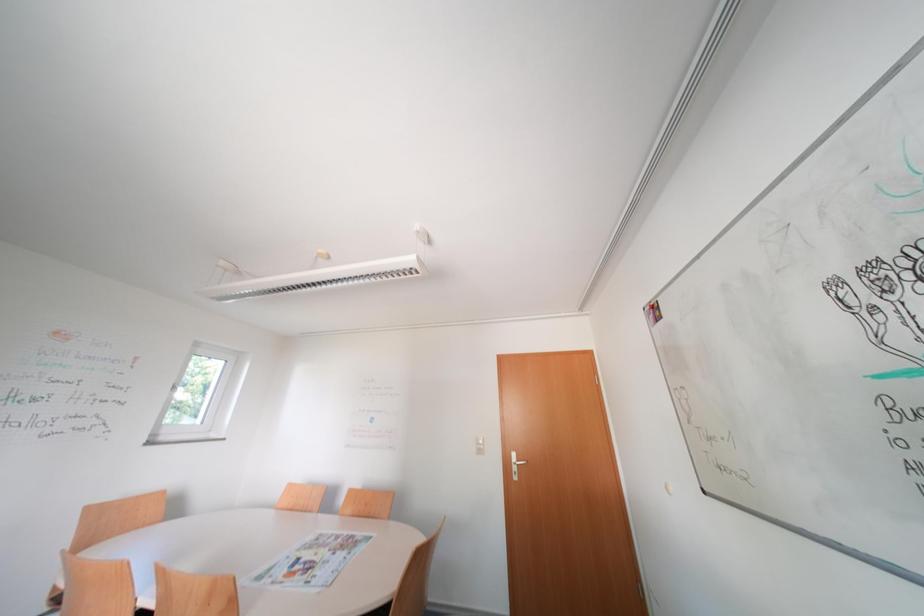
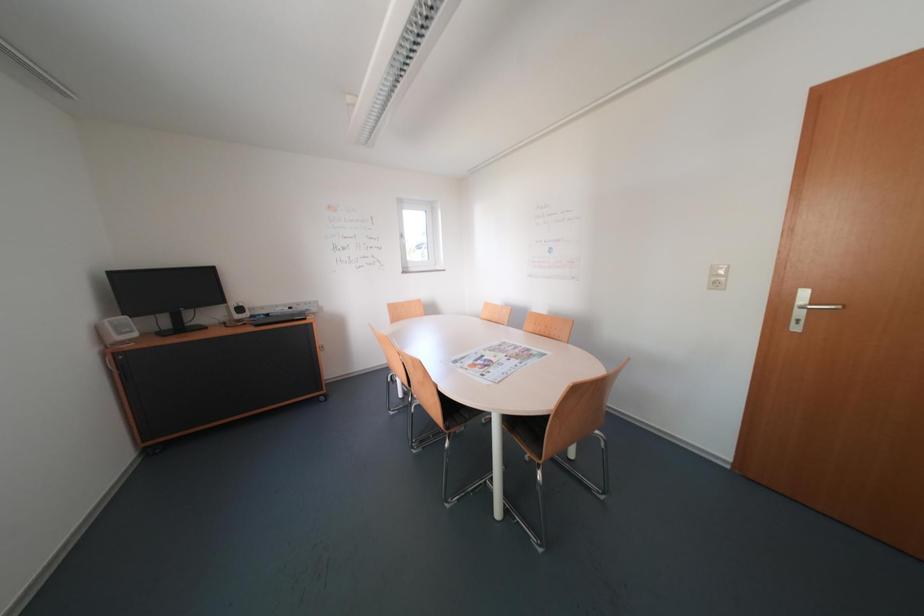
The first image is from the beginning of the video and the second image is from the end. How did the camera likely rotate when shooting the video?

The camera rotated toward left-down.